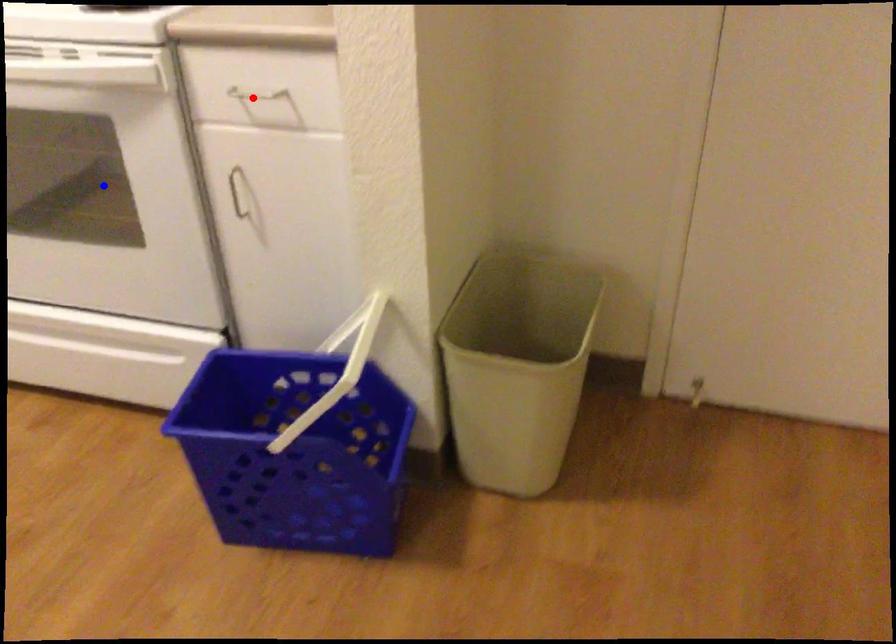
Question: Two points are marked on the image. Which point is closer to the camera?

Choices:
 (A) Blue point is closer.
 (B) Red point is closer.

Answer: (B)